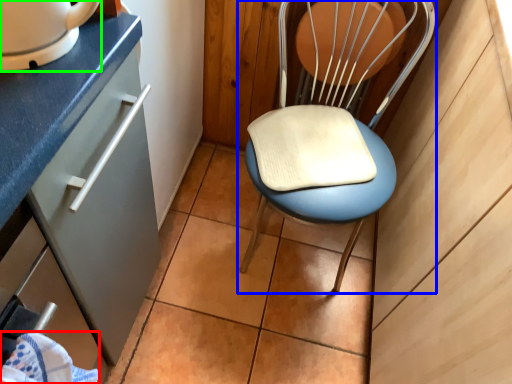
Question: Which is farther away from material (highlighted by a red box)? chair (highlighted by a blue box) or home appliance (highlighted by a green box)?

Choices:
 (A) chair
 (B) home appliance

Answer: (A)